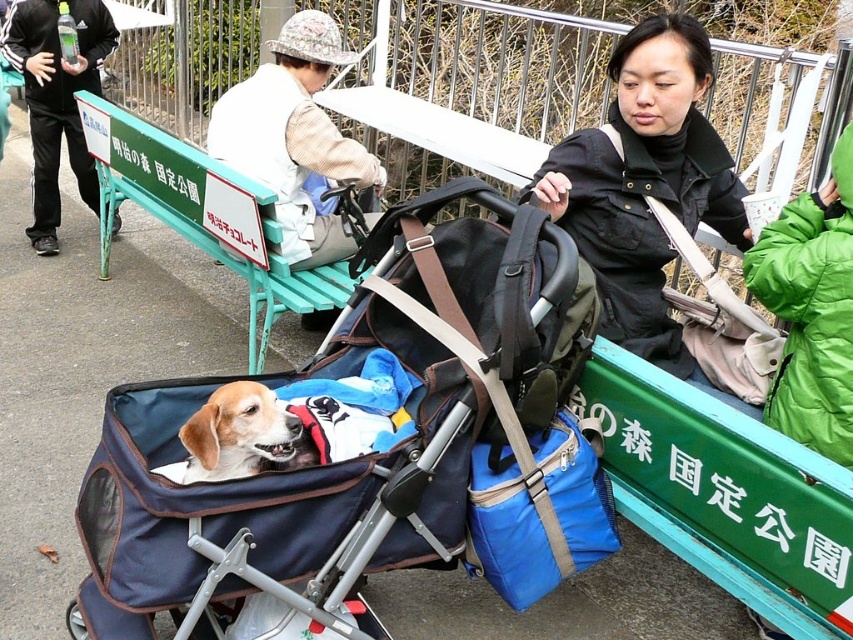
Based on the photo, which of these two, green down jacket at upper right or blue fabric cooler at center, stands shorter?

With less height is blue fabric cooler at center.

Which is below, green down jacket at upper right or blue fabric cooler at center?

blue fabric cooler at center

Between point (820, 196) and point (608, 547), which one is positioned in front?

Point (820, 196)

This screenshot has width=853, height=640. What are the coordinates of `green down jacket at upper right` in the screenshot? It's located at (811, 308).

This screenshot has width=853, height=640. I want to click on blue fabric cooler at center, so click(538, 515).

Which is more to the right, blue fabric cooler at center or light brown fur at center?

From the viewer's perspective, blue fabric cooler at center appears more on the right side.

This screenshot has width=853, height=640. Describe the element at coordinates (538, 515) in the screenshot. I see `blue fabric cooler at center` at that location.

Where is `blue fabric cooler at center`? blue fabric cooler at center is located at coordinates (538, 515).

Is green down jacket at upper right taller than white cotton jacket at upper center?

No.

Can you confirm if green down jacket at upper right is smaller than white cotton jacket at upper center?

Yes, green down jacket at upper right is smaller than white cotton jacket at upper center.

Describe the element at coordinates (811, 308) in the screenshot. I see `green down jacket at upper right` at that location.

Find the location of a particular element. This screenshot has width=853, height=640. green down jacket at upper right is located at coordinates (811, 308).